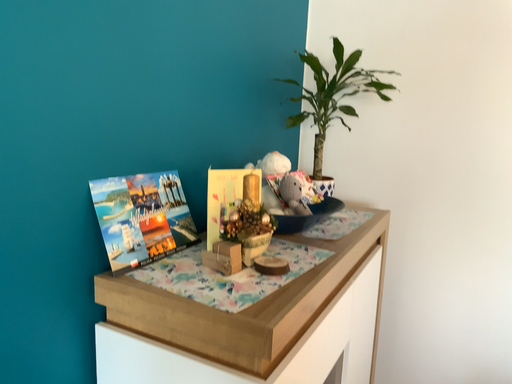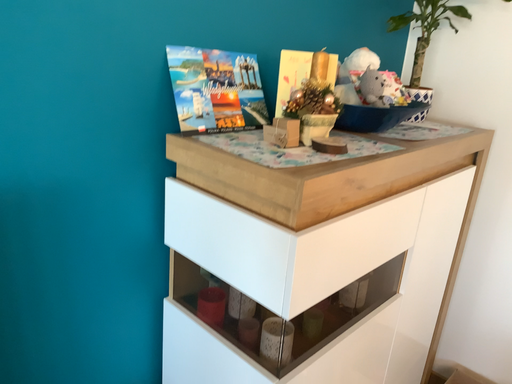
Question: Which way did the camera rotate in the video?

Choices:
 (A) rotated right
 (B) rotated left

Answer: (B)